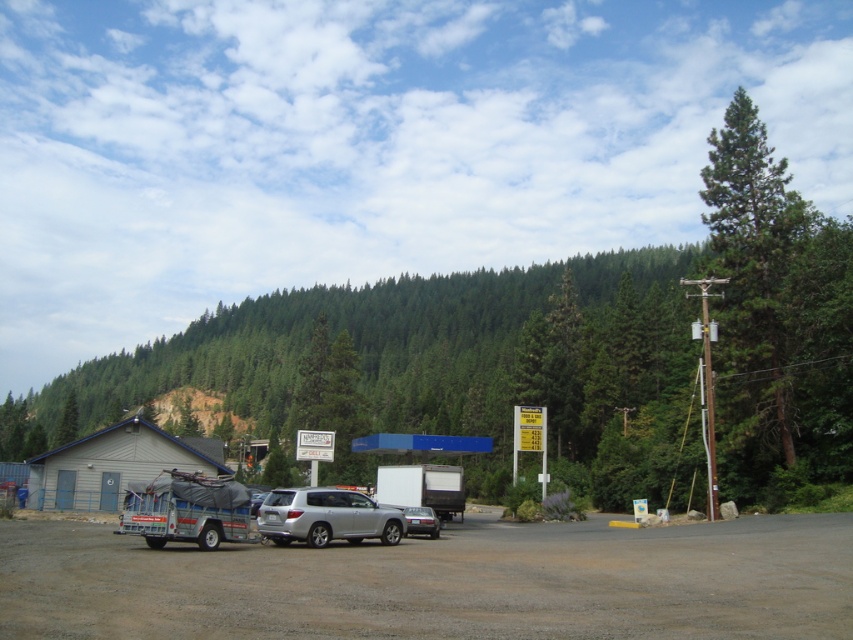
You are standing at the center of the image and want to locate the metallic silver pickup truck at lower left. According to the coordinate system where the bottom left corner is the origin, what are its coordinates?

The metallic silver pickup truck at lower left is located at coordinates point (186, 509).

You are standing at the entrance of the gas station and see the metallic silver pickup truck at lower left and the green leafy tree at center. Which object is positioned more to the right side of the image?

The metallic silver pickup truck at lower left is positioned to the right of the green leafy tree at center, so it is more to the right side of the image.